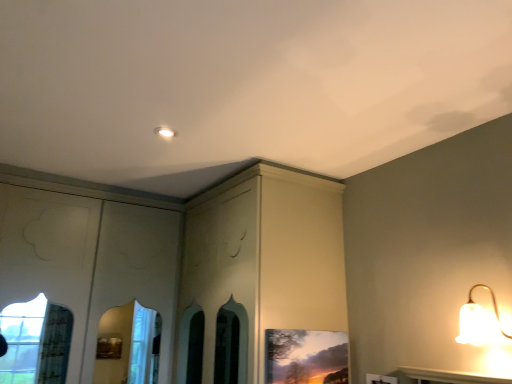
Question: Is matte wooden picture frame at lower center wider or thinner than white frosted glass lamp at upper right?

Choices:
 (A) thin
 (B) wide

Answer: (A)

Question: Is matte wooden picture frame at lower center to the left or to the right of white frosted glass lamp at upper right in the image?

Choices:
 (A) right
 (B) left

Answer: (B)

Question: In terms of size, does matte wooden picture frame at lower center appear bigger or smaller than white frosted glass lamp at upper right?

Choices:
 (A) big
 (B) small

Answer: (B)

Question: From their relative heights in the image, would you say white frosted glass lamp at upper right is taller or shorter than matte wooden picture frame at lower center?

Choices:
 (A) short
 (B) tall

Answer: (A)

Question: Considering their positions, is white frosted glass lamp at upper right located in front of or behind matte wooden picture frame at lower center?

Choices:
 (A) behind
 (B) front

Answer: (B)

Question: From a real-world perspective, is white frosted glass lamp at upper right above or below matte wooden picture frame at lower center?

Choices:
 (A) below
 (B) above

Answer: (B)

Question: Looking at the image, does white frosted glass lamp at upper right seem bigger or smaller compared to matte wooden picture frame at lower center?

Choices:
 (A) big
 (B) small

Answer: (A)